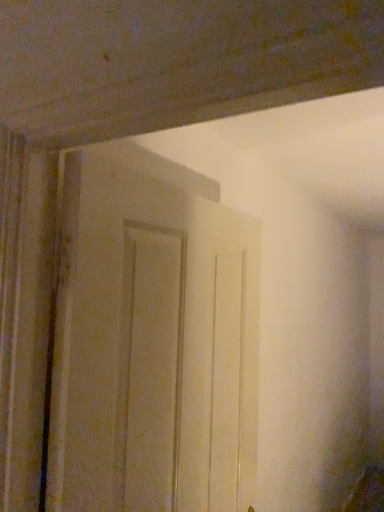
What do you see at coordinates (152, 341) in the screenshot?
I see `white matte door at center` at bounding box center [152, 341].

Where is `white matte door at center`? white matte door at center is located at coordinates (152, 341).

Find the location of a particular element. This screenshot has height=512, width=384. white matte door at center is located at coordinates (152, 341).